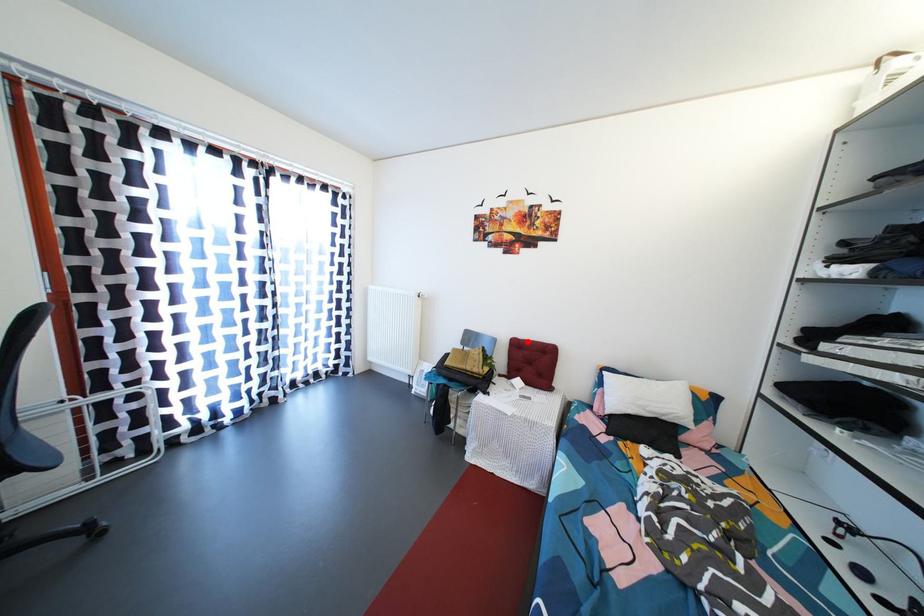
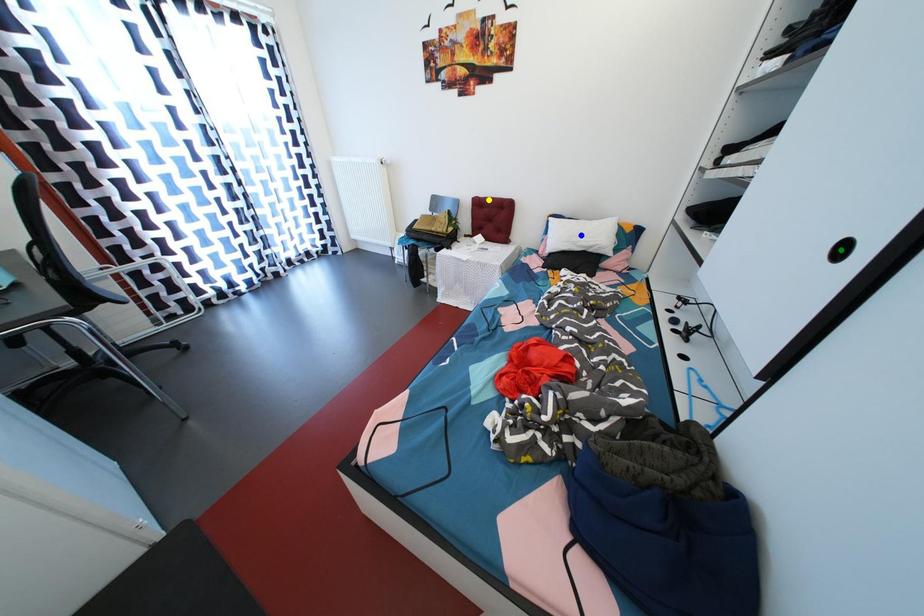
Question: I am providing you with two images of the same scene from different viewpoints. A red point is marked on the first image. You are given multiple points on the second image. Which point in image 2 represents the same 3d spot as the red point in image 1?

Choices:
 (A) blue point
 (B) yellow point
 (C) green point

Answer: (B)